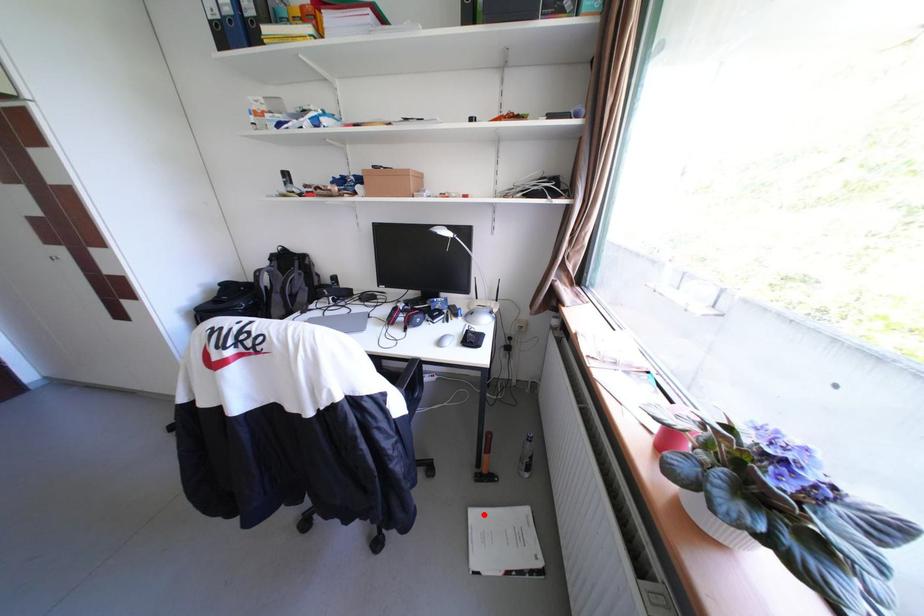
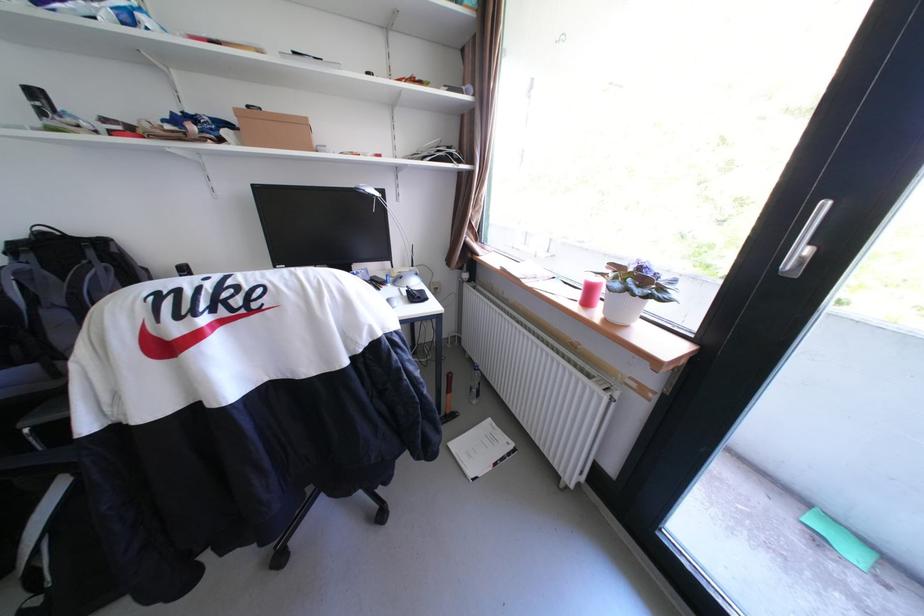
Question: I am providing you with two images of the same scene from different viewpoints. In image1, a red point is highlighted. Considering the same 3D point in image2, which of the following is correct?

Choices:
 (A) It is closer
 (B) It is farther

Answer: (A)